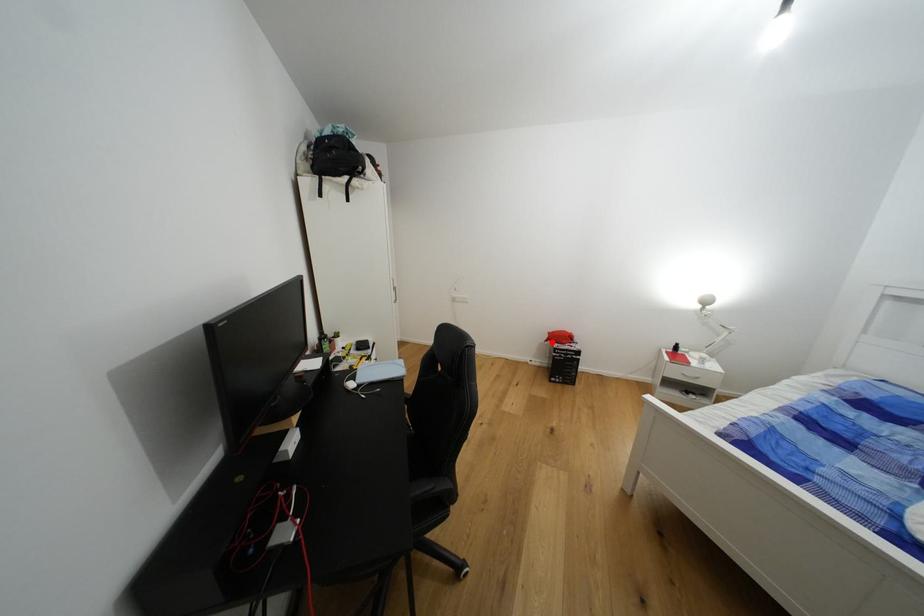
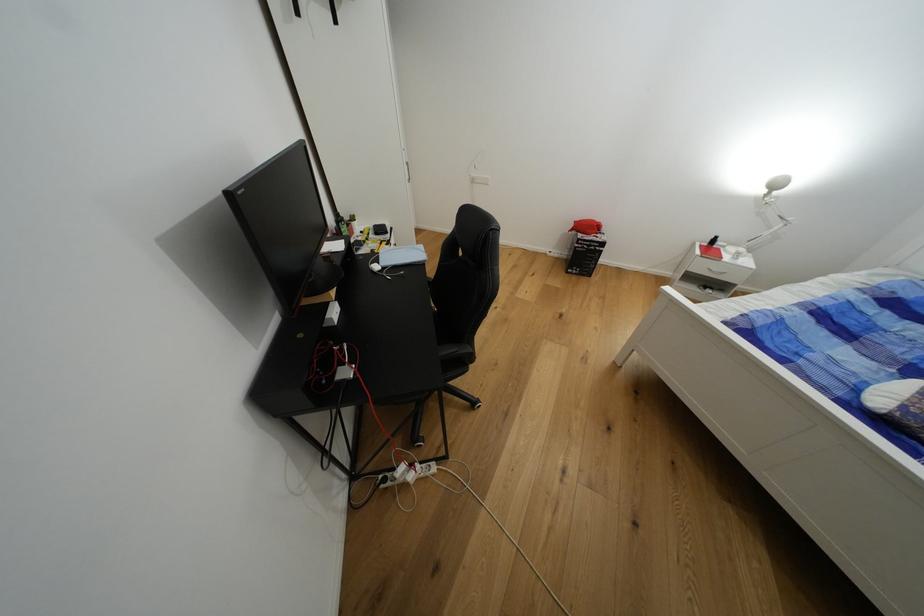
In the second image, find the point that corresponds to the highlighted location in the first image.

(576, 232)